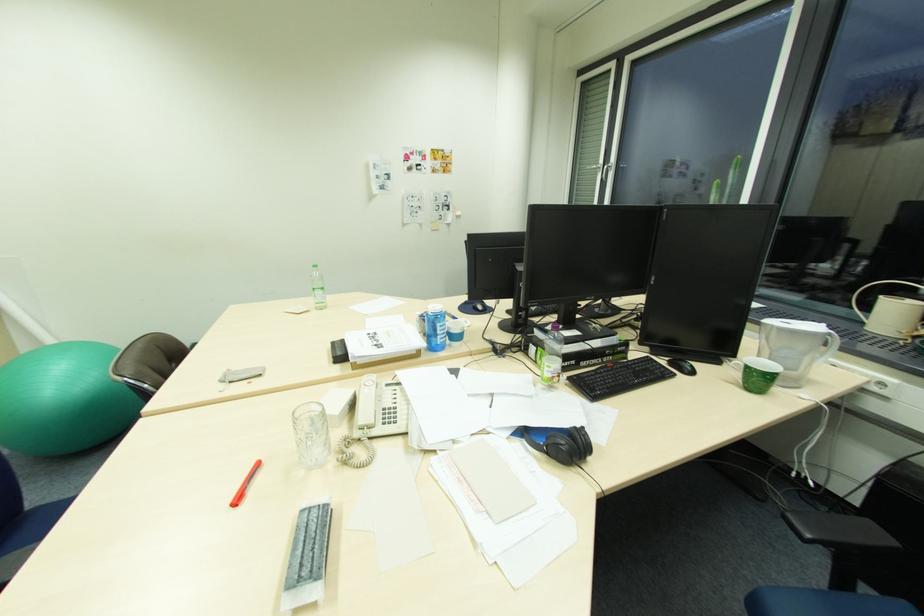
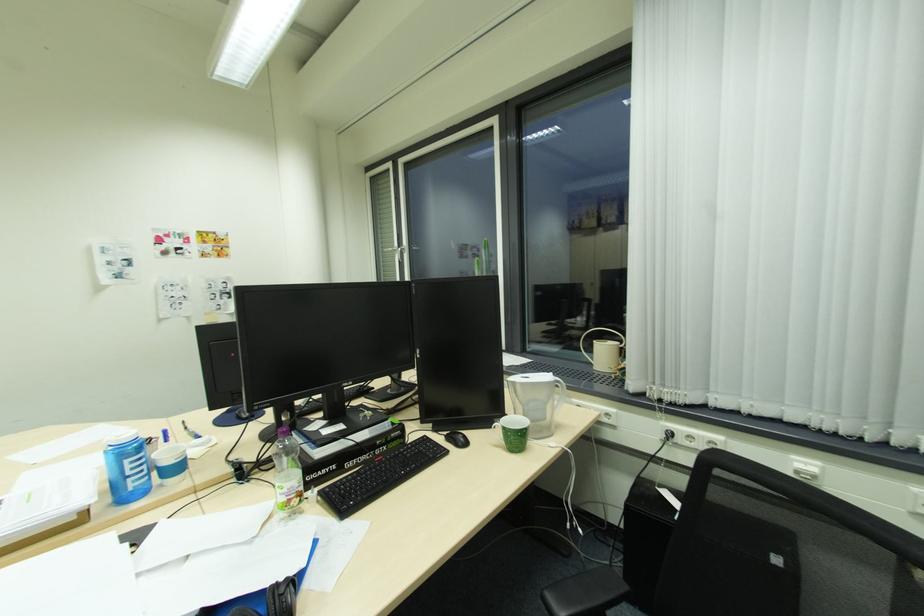
Find the pixel in the second image that matches pixel 553 365 in the first image.

(286, 485)